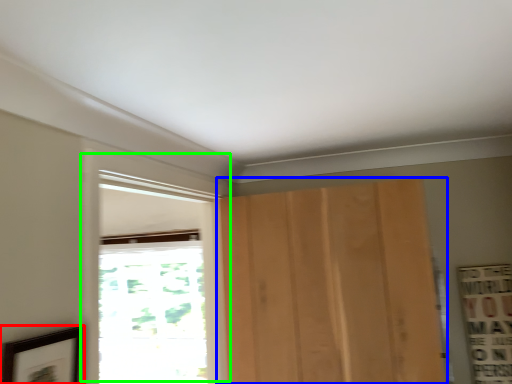
Question: Which object is the closest to the picture frame (highlighted by a red box)? Choose among these: door (highlighted by a blue box) or window (highlighted by a green box).

Choices:
 (A) door
 (B) window

Answer: (B)